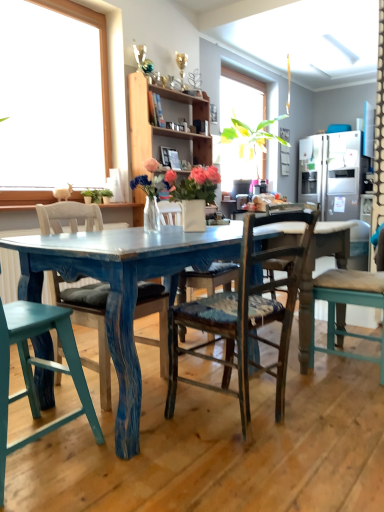
Image resolution: width=384 pixels, height=512 pixels. What do you see at coordinates (332, 173) in the screenshot?
I see `satin silver refrigerator at right` at bounding box center [332, 173].

Where is `wooden shelf at upper center`? Image resolution: width=384 pixels, height=512 pixels. wooden shelf at upper center is located at coordinates (164, 128).

Image resolution: width=384 pixels, height=512 pixels. What do you see at coordinates (88, 324) in the screenshot?
I see `distressed teal chair at center, arranged as the 2th chair when viewed from the left` at bounding box center [88, 324].

Image resolution: width=384 pixels, height=512 pixels. What do you see at coordinates (345, 306) in the screenshot? I see `wooden chair with cushion at right, the 1th chair positioned from the right` at bounding box center [345, 306].

At what (x,y) coordinates should I click in order to perform the action: click on satin silver refrigerator at right. Please return your answer as a coordinate pair (x, y). Looking at the image, I should click on (332, 173).

Would you say satin silver refrigerator at right is a long distance from wooden chair with cushion at right, acting as the fourth chair starting from the left?

Yes, satin silver refrigerator at right and wooden chair with cushion at right, acting as the fourth chair starting from the left, are quite far apart.

Identify the location of refrigerator above the wooden chair with cushion at right, acting as the fourth chair starting from the left (from a real-world perspective). (332, 173).

From the image's perspective, is satin silver refrigerator at right on top of wooden chair with cushion at right, the 1th chair positioned from the right?

Yes.

Would you say satin silver refrigerator at right contains wooden chair with cushion at right, acting as the fourth chair starting from the left?

No, satin silver refrigerator at right does not contain wooden chair with cushion at right, acting as the fourth chair starting from the left.

From the worn wood chair at center, placed as the second chair when sorted from right to left, count 2nd chairs backward and point to it. Please provide its 2D coordinates.

[(345, 306)]

Which object is positioned more to the left, worn wood chair at center, placed as the second chair when sorted from right to left, or wooden chair with cushion at right, acting as the fourth chair starting from the left?

From the viewer's perspective, worn wood chair at center, placed as the second chair when sorted from right to left, appears more on the left side.

Is worn wood chair at center, which is counted as the third chair, starting from the left, aimed at wooden chair with cushion at right, acting as the fourth chair starting from the left?

No, worn wood chair at center, which is counted as the third chair, starting from the left, is not turned towards wooden chair with cushion at right, acting as the fourth chair starting from the left.

Looking at their sizes, would you say worn wood chair at center, which is counted as the third chair, starting from the left, is wider or thinner than wooden chair with cushion at right, the 1th chair positioned from the right?

worn wood chair at center, which is counted as the third chair, starting from the left, is wider than wooden chair with cushion at right, the 1th chair positioned from the right.

Considering the sizes of objects worn wood chair at center, which is counted as the third chair, starting from the left, and satin silver refrigerator at right in the image provided, who is thinner, worn wood chair at center, which is counted as the third chair, starting from the left, or satin silver refrigerator at right?

Thinner between the two is worn wood chair at center, which is counted as the third chair, starting from the left.

Can you confirm if worn wood chair at center, which is counted as the third chair, starting from the left, is taller than satin silver refrigerator at right?

No, worn wood chair at center, which is counted as the third chair, starting from the left, is not taller than satin silver refrigerator at right.

From the image's perspective, between worn wood chair at center, placed as the second chair when sorted from right to left, and satin silver refrigerator at right, which one is located above?

satin silver refrigerator at right is shown above in the image.

Which of these two, worn wood chair at center, which is counted as the third chair, starting from the left, or satin silver refrigerator at right, is bigger?

Bigger between the two is satin silver refrigerator at right.

Find the location of `floral arrangement in front of the wooden shelf at upper center`. floral arrangement in front of the wooden shelf at upper center is located at coordinates (194, 184).

Can you confirm if wooden shelf at upper center is positioned to the left of matte white vase at center?

Yes, wooden shelf at upper center is to the left of matte white vase at center.

Who is shorter, wooden shelf at upper center or matte white vase at center?

matte white vase at center is shorter.

Which object is further away from the camera taking this photo, wooden shelf at upper center or matte white vase at center?

wooden shelf at upper center.

Can you confirm if wooden chair with cushion at right, acting as the fourth chair starting from the left, is positioned to the right of distressed teal chair at center, placed as the 3th chair when sorted from right to left?

Yes, wooden chair with cushion at right, acting as the fourth chair starting from the left, is to the right of distressed teal chair at center, placed as the 3th chair when sorted from right to left.

Who is shorter, wooden chair with cushion at right, acting as the fourth chair starting from the left, or distressed teal chair at center, placed as the 3th chair when sorted from right to left?

distressed teal chair at center, placed as the 3th chair when sorted from right to left, is shorter.

From a real-world perspective, does wooden chair with cushion at right, the 1th chair positioned from the right, stand above distressed teal chair at center, placed as the 3th chair when sorted from right to left?

Indeed, from a real-world perspective, wooden chair with cushion at right, the 1th chair positioned from the right, stands above distressed teal chair at center, placed as the 3th chair when sorted from right to left.

Where is `chair that is the 2nd one above the distressed teal chair at center, arranged as the 2th chair when viewed from the left (from a real-world perspective)`? The width and height of the screenshot is (384, 512). chair that is the 2nd one above the distressed teal chair at center, arranged as the 2th chair when viewed from the left (from a real-world perspective) is located at coordinates point(345,306).

From the image's perspective, does worn wood chair at center, which is counted as the third chair, starting from the left, appear higher than wooden shelf at upper center?

Incorrect, from the image's perspective, worn wood chair at center, which is counted as the third chair, starting from the left, is lower than wooden shelf at upper center.

Consider the image. Is worn wood chair at center, which is counted as the third chair, starting from the left, placed right next to wooden shelf at upper center?

No, worn wood chair at center, which is counted as the third chair, starting from the left, is not touching wooden shelf at upper center.

Based on their sizes in the image, would you say worn wood chair at center, placed as the second chair when sorted from right to left, is bigger or smaller than wooden shelf at upper center?

Considering their sizes, worn wood chair at center, placed as the second chair when sorted from right to left, takes up less space than wooden shelf at upper center.

From a real-world perspective, which is physically above, worn wood chair at center, which is counted as the third chair, starting from the left, or wooden shelf at upper center?

wooden shelf at upper center.

Is matte white vase at center looking in the opposite direction of wooden shelf at upper center?

No.

Is matte white vase at center not close to wooden shelf at upper center?

That's right, there is a large distance between matte white vase at center and wooden shelf at upper center.

From the image's perspective, which object appears higher, matte white vase at center or wooden shelf at upper center?

wooden shelf at upper center is shown above in the image.

Is matte white vase at center thinner than wooden shelf at upper center?

Correct, the width of matte white vase at center is less than that of wooden shelf at upper center.

Where is `refrigerator lying on the right of wooden chair with cushion at right, the 1th chair positioned from the right`? The image size is (384, 512). refrigerator lying on the right of wooden chair with cushion at right, the 1th chair positioned from the right is located at coordinates (332, 173).

Image resolution: width=384 pixels, height=512 pixels. I want to click on the 1st chair to the left of the wooden chair with cushion at right, acting as the fourth chair starting from the left, counting from the anchor's position, so click(x=243, y=319).

Which object lies further to the anchor point satin silver refrigerator at right, matte white vase at center or worn wood chair at center, which is counted as the third chair, starting from the left?

The object further to satin silver refrigerator at right is worn wood chair at center, which is counted as the third chair, starting from the left.

Which object lies further to the anchor point distressed teal chair at center, placed as the 3th chair when sorted from right to left, teal wood chair at lower left, marked as the 1th chair in a left-to-right arrangement, or wooden chair with cushion at right, acting as the fourth chair starting from the left?

wooden chair with cushion at right, acting as the fourth chair starting from the left.

When comparing their distances from distressed teal chair at center, arranged as the 2th chair when viewed from the left, does matte white vase at center or worn wood chair at center, which is counted as the third chair, starting from the left, seem further?

matte white vase at center is further to distressed teal chair at center, arranged as the 2th chair when viewed from the left.

Based on their spatial positions, is worn wood chair at center, placed as the second chair when sorted from right to left, or wooden chair with cushion at right, the 1th chair positioned from the right, further from teal wood chair at lower left, which is the 4th chair in right-to-left order?

The object further to teal wood chair at lower left, which is the 4th chair in right-to-left order, is wooden chair with cushion at right, the 1th chair positioned from the right.

Which object lies nearer to the anchor point matte white vase at center, distressed teal chair at center, placed as the 3th chair when sorted from right to left, or wooden chair with cushion at right, acting as the fourth chair starting from the left?

Among the two, distressed teal chair at center, placed as the 3th chair when sorted from right to left, is located nearer to matte white vase at center.

Based on their spatial positions, is teal wood chair at lower left, which is the 4th chair in right-to-left order, or wooden shelf at upper center further from matte white vase at center?

wooden shelf at upper center lies further to matte white vase at center than the other object.

Estimate the real-world distances between objects in this image. Which object is closer to teal wood chair at lower left, which is the 4th chair in right-to-left order, matte white vase at center or worn wood chair at center, placed as the second chair when sorted from right to left?

worn wood chair at center, placed as the second chair when sorted from right to left, lies closer to teal wood chair at lower left, which is the 4th chair in right-to-left order, than the other object.

Estimate the real-world distances between objects in this image. Which object is closer to worn wood chair at center, placed as the second chair when sorted from right to left, distressed teal chair at center, placed as the 3th chair when sorted from right to left, or wooden shelf at upper center?

distressed teal chair at center, placed as the 3th chair when sorted from right to left, is positioned closer to the anchor worn wood chair at center, placed as the second chair when sorted from right to left.

The image size is (384, 512). I want to click on cabinetry located between wooden chair with cushion at right, acting as the fourth chair starting from the left, and satin silver refrigerator at right in the depth direction, so click(164, 128).

Image resolution: width=384 pixels, height=512 pixels. I want to click on floral arrangement located between distressed teal chair at center, placed as the 3th chair when sorted from right to left, and wooden shelf at upper center in the depth direction, so click(x=194, y=184).

Where is `floral arrangement between teal wood chair at lower left, marked as the 1th chair in a left-to-right arrangement, and satin silver refrigerator at right in the front-back direction`? floral arrangement between teal wood chair at lower left, marked as the 1th chair in a left-to-right arrangement, and satin silver refrigerator at right in the front-back direction is located at coordinates (194, 184).

I want to click on chair located between teal wood chair at lower left, which is the 4th chair in right-to-left order, and worn wood chair at center, placed as the second chair when sorted from right to left, in the left-right direction, so click(x=88, y=324).